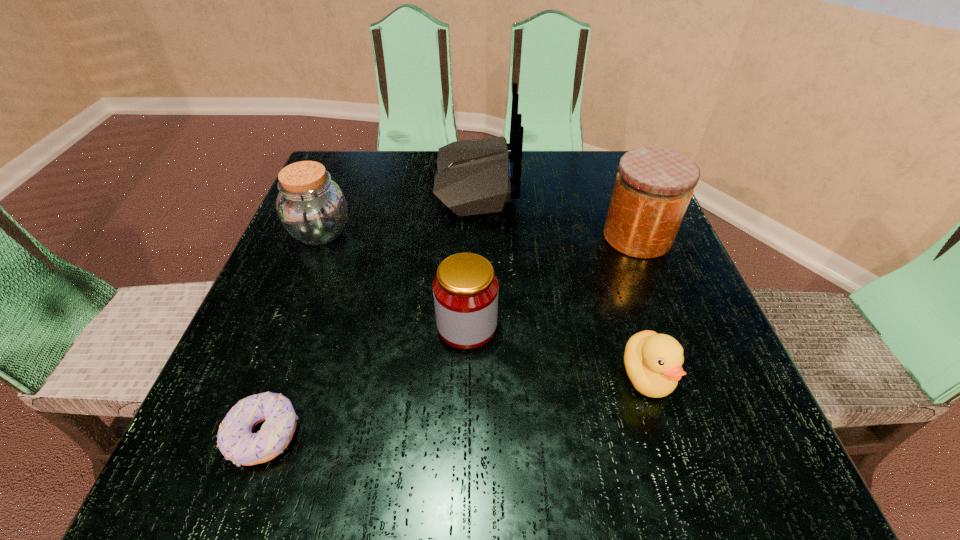
The width and height of the screenshot is (960, 540). Identify the location of unoccupied position between the rightmost jar and the router. coord(556,210).

Locate an element on the screen. free space between the second jar from right to left and the shortest object is located at coordinates (366, 381).

Locate an element on the screen. The width and height of the screenshot is (960, 540). vacant area between the nearest jar and the rightmost jar is located at coordinates (552, 281).

Identify which object is the fourth nearest to the shortest object. Please provide its 2D coordinates. Your answer should be formatted as a tuple, i.e. [(x, y)], where the tuple contains the x and y coordinates of a point satisfying the conditions above.

[(653, 362)]

The image size is (960, 540). Find the location of `object that is the closest one to the doughnut`. object that is the closest one to the doughnut is located at coordinates (465, 289).

At what (x,y) coordinates should I click in order to perform the action: click on the closest jar to the nearest jar. Please return your answer as a coordinate pair (x, y). Looking at the image, I should click on 311,207.

The width and height of the screenshot is (960, 540). I want to click on the closest jar relative to the second shortest object, so click(465, 289).

Where is `vacant space that satisfies the following two spatial constraints: 1. on the back of the router; 2. on the left side of the rightmost jar`? vacant space that satisfies the following two spatial constraints: 1. on the back of the router; 2. on the left side of the rightmost jar is located at coordinates (474, 237).

Identify the location of free space that satisfies the following two spatial constraints: 1. on the back of the rightmost jar; 2. on the left side of the router. Image resolution: width=960 pixels, height=540 pixels. (474, 237).